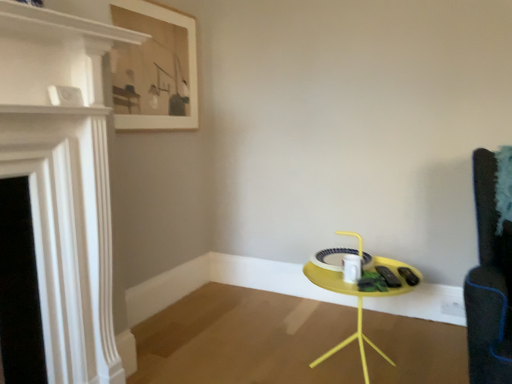
Question: Can you confirm if wooden framed artwork at upper left is wider than white glossy fireplace at left?

Choices:
 (A) no
 (B) yes

Answer: (A)

Question: Is wooden framed artwork at upper left at the left side of white glossy fireplace at left?

Choices:
 (A) yes
 (B) no

Answer: (B)

Question: Considering the relative positions of wooden framed artwork at upper left and white glossy fireplace at left in the image provided, is wooden framed artwork at upper left to the right of white glossy fireplace at left from the viewer's perspective?

Choices:
 (A) yes
 (B) no

Answer: (A)

Question: From a real-world perspective, does wooden framed artwork at upper left stand above white glossy fireplace at left?

Choices:
 (A) yes
 (B) no

Answer: (A)

Question: Is white glossy fireplace at left completely or partially inside wooden framed artwork at upper left?

Choices:
 (A) no
 (B) yes

Answer: (A)

Question: Considering the positions of yellow matte table at center and wooden framed artwork at upper left in the image, is yellow matte table at center taller or shorter than wooden framed artwork at upper left?

Choices:
 (A) short
 (B) tall

Answer: (A)

Question: In terms of width, does yellow matte table at center look wider or thinner when compared to wooden framed artwork at upper left?

Choices:
 (A) thin
 (B) wide

Answer: (B)

Question: Is yellow matte table at center inside the boundaries of wooden framed artwork at upper left, or outside?

Choices:
 (A) inside
 (B) outside

Answer: (B)

Question: Relative to wooden framed artwork at upper left, is yellow matte table at center in front or behind?

Choices:
 (A) behind
 (B) front

Answer: (B)

Question: Does point (19, 3) appear closer or farther from the camera than point (404, 284)?

Choices:
 (A) closer
 (B) farther

Answer: (A)

Question: Which is correct: white glossy fireplace at left is inside yellow matte table at center, or outside of it?

Choices:
 (A) inside
 (B) outside

Answer: (B)

Question: From a real-world perspective, is white glossy fireplace at left positioned above or below yellow matte table at center?

Choices:
 (A) below
 (B) above

Answer: (B)

Question: Looking at the image, does white glossy fireplace at left seem bigger or smaller compared to yellow matte table at center?

Choices:
 (A) big
 (B) small

Answer: (B)

Question: Considering the relative positions of white glossy fireplace at left and wooden framed artwork at upper left in the image provided, is white glossy fireplace at left to the left or to the right of wooden framed artwork at upper left?

Choices:
 (A) right
 (B) left

Answer: (B)

Question: From a real-world perspective, is white glossy fireplace at left physically located above or below wooden framed artwork at upper left?

Choices:
 (A) below
 (B) above

Answer: (A)